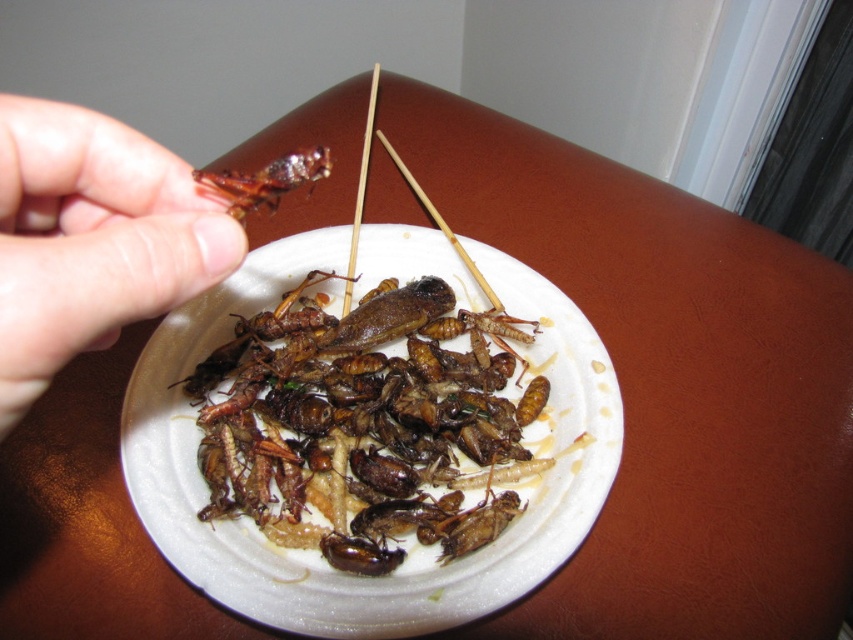
Between brown crispy insects at center and wooden chopsticks at center, which one is positioned higher?

wooden chopsticks at center

Who is more distant from viewer, (x=302, y=484) or (x=466, y=268)?

Point (x=466, y=268)

Image resolution: width=853 pixels, height=640 pixels. What are the coordinates of `brown crispy insects at center` in the screenshot? It's located at (366, 422).

Can you confirm if flesh-toned skin at upper left is positioned below shiny brown insect at upper left?

Yes, flesh-toned skin at upper left is below shiny brown insect at upper left.

Is flesh-toned skin at upper left bigger than shiny brown insect at upper left?

Yes.

Find the location of a particular element. Image resolution: width=853 pixels, height=640 pixels. flesh-toned skin at upper left is located at coordinates (91, 237).

Between smooth wood chopstick at center and wooden chopsticks at center, which one has more height?

smooth wood chopstick at center

Measure the distance between point (358, 212) and camera.

32.46 inches

Locate an element on the screen. smooth wood chopstick at center is located at coordinates (360, 188).